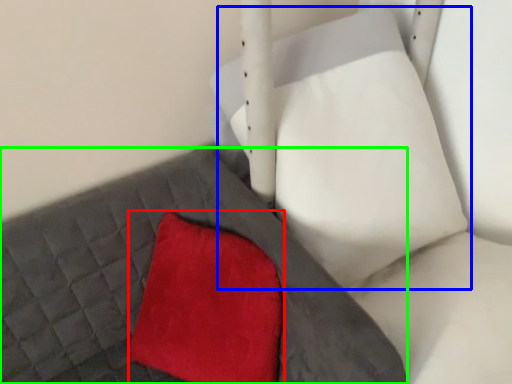
Question: Based on their relative distances, which object is farther from throw pillow (highlighted by a red box)? Choose from bean bag chair (highlighted by a blue box) and bed frame (highlighted by a green box).

Choices:
 (A) bean bag chair
 (B) bed frame

Answer: (A)